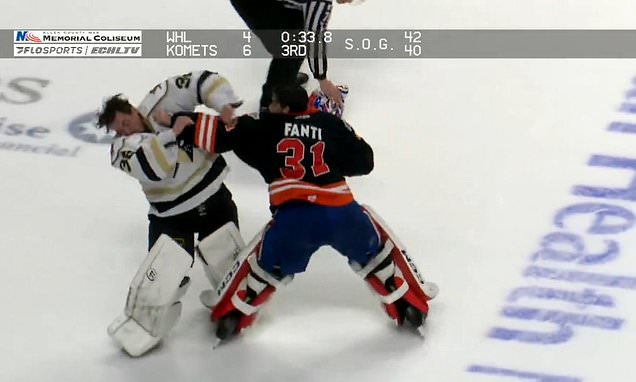
The width and height of the screenshot is (636, 382). Find the location of `towel`. towel is located at coordinates (343, 89).